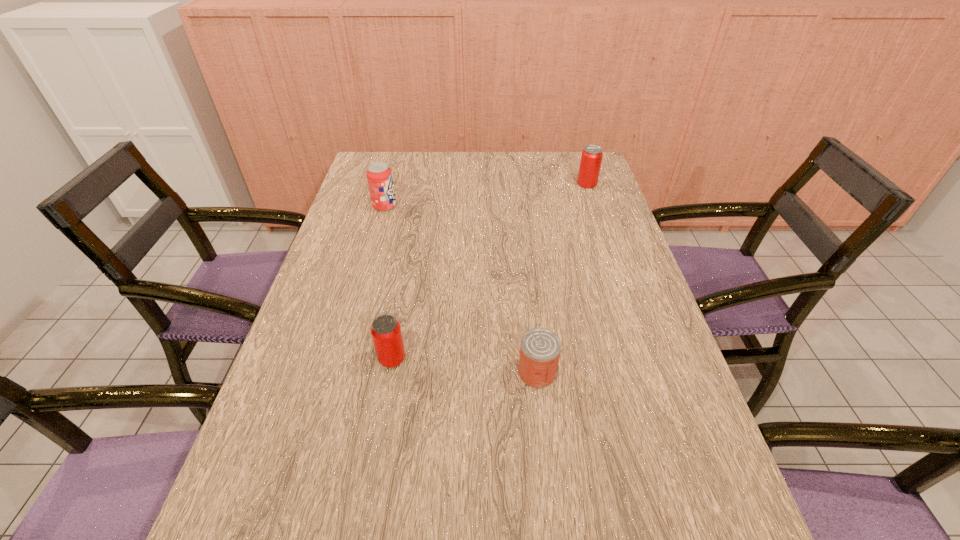
Where is `vacant space that's between the third object from right to left and the soda can`? This screenshot has width=960, height=540. vacant space that's between the third object from right to left and the soda can is located at coordinates (388, 282).

Find the location of a particular element. This screenshot has width=960, height=540. unoccupied area between the rightmost can and the second object from left to right is located at coordinates (490, 272).

Where is `vacant space that is in between the farthest can and the second farthest object`? This screenshot has width=960, height=540. vacant space that is in between the farthest can and the second farthest object is located at coordinates (486, 195).

Image resolution: width=960 pixels, height=540 pixels. Find the location of `vacant space in between the third nearest object and the second can from left to right`. vacant space in between the third nearest object and the second can from left to right is located at coordinates (461, 289).

Locate an element on the screen. vacant region between the second farthest object and the rightmost can is located at coordinates (486, 195).

This screenshot has height=540, width=960. What are the coordinates of `vacant point located between the soda can and the shortest object` in the screenshot? It's located at (461, 289).

Find the location of a particular element. This screenshot has width=960, height=540. empty space that is in between the third object from left to right and the leftmost can is located at coordinates (465, 366).

Where is `free space between the farthest object and the shortest object`? free space between the farthest object and the shortest object is located at coordinates (562, 278).

Find the location of a particular element. This screenshot has height=540, width=960. object that ranks as the third closest to the second object from right to left is located at coordinates (591, 158).

What are the coordinates of `object that stands as the third closest to the leftmost can` in the screenshot? It's located at (591, 158).